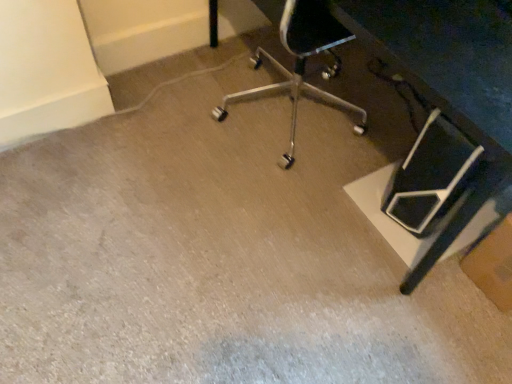
Question: In terms of width, does brown cardboard box at lower right look wider or thinner when compared to black plastic table at center?

Choices:
 (A) wide
 (B) thin

Answer: (B)

Question: Looking at the image, does brown cardboard box at lower right seem bigger or smaller compared to black plastic table at center?

Choices:
 (A) small
 (B) big

Answer: (A)

Question: In terms of height, does brown cardboard box at lower right look taller or shorter compared to black plastic table at center?

Choices:
 (A) short
 (B) tall

Answer: (A)

Question: Considering the positions of black plastic table at center and brown cardboard box at lower right in the image, is black plastic table at center wider or thinner than brown cardboard box at lower right?

Choices:
 (A) wide
 (B) thin

Answer: (A)

Question: Do you think black plastic table at center is within brown cardboard box at lower right, or outside of it?

Choices:
 (A) inside
 (B) outside

Answer: (B)

Question: Is black plastic table at center taller or shorter than brown cardboard box at lower right?

Choices:
 (A) short
 (B) tall

Answer: (B)

Question: Would you say black plastic table at center is to the left or to the right of brown cardboard box at lower right in the picture?

Choices:
 (A) right
 (B) left

Answer: (B)